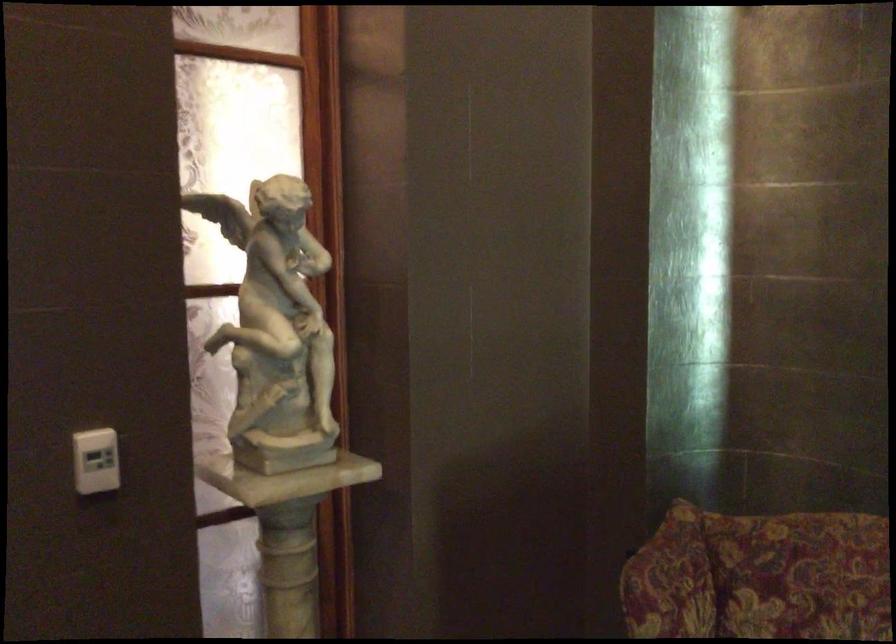
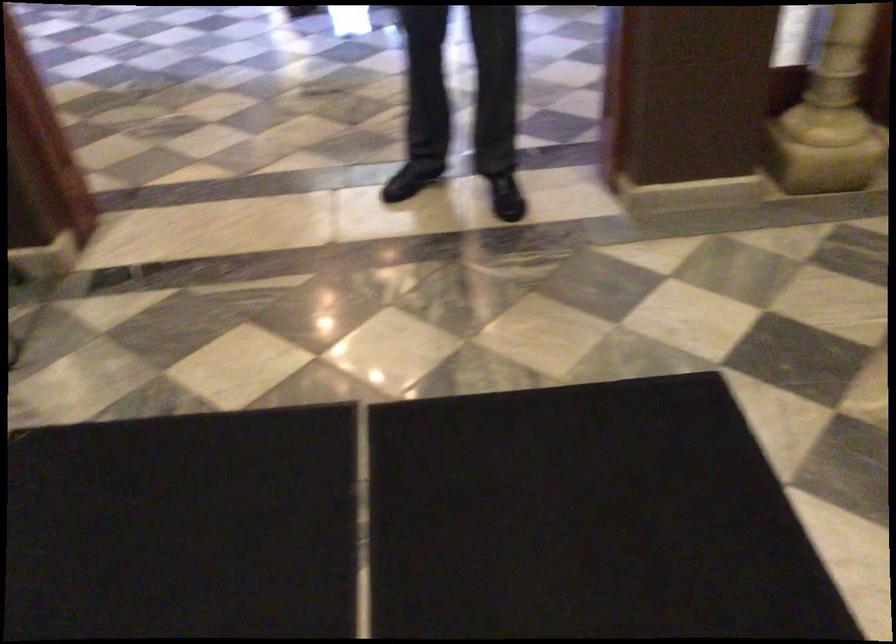
First-person continuous shooting, in which direction is the camera rotating?

The rotation direction of the camera is left-down.